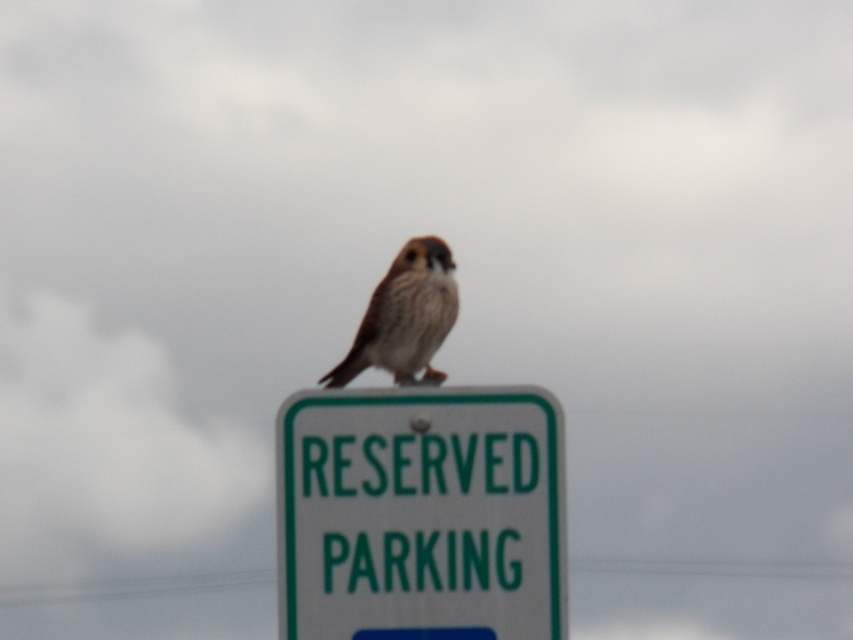
Question: Which of the following is the farthest from the observer?

Choices:
 (A) green plastic power line at lower center
 (B) brown feathered bird at center

Answer: (A)

Question: Which point is closer to the camera taking this photo?

Choices:
 (A) (372, 294)
 (B) (213, 577)

Answer: (A)

Question: Which is nearer to the brown feathered bird at center?

Choices:
 (A) green plastic power line at lower center
 (B) green plastic sign at center

Answer: (B)

Question: Is green plastic sign at center positioned before green plastic power line at lower center?

Choices:
 (A) yes
 (B) no

Answer: (A)

Question: Is brown feathered bird at center to the left of green plastic power line at lower center from the viewer's perspective?

Choices:
 (A) yes
 (B) no

Answer: (B)

Question: Is green plastic sign at center positioned behind brown feathered bird at center?

Choices:
 (A) no
 (B) yes

Answer: (A)